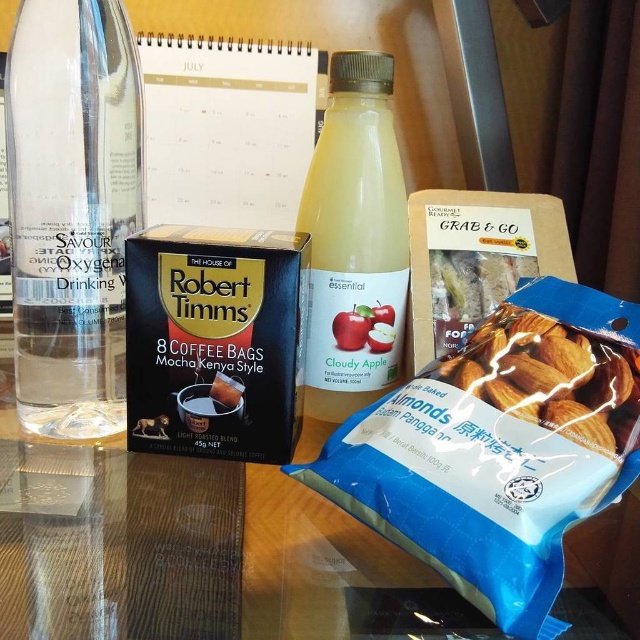
You are standing in front of the table with the items. There are two points marked on the table surface. One is at coordinate point (394, 148) and the other is at point (598, 369). Which point is closer to you?

Point (394, 148) is closer to you because it is further to the camera than point (598, 369).

You are a delivery person who needs to place a new item between the clear glass bottle at left and the cloudy apple juice at center. The item is 7 inches long. Will there be enough space between them to fit the item?

The clear glass bottle at left and cloudy apple juice at center are 7.45 inches apart from each other. Since the item is 7 inches long, there is sufficient space to fit it between them as 7 inches is less than 7.45 inches.

You are setting up a small breakfast table and need to arrange the cloudy apple juice at center and the smooth almond at lower right. Considering their sizes, which item should you place first to ensure stability?

The cloudy apple juice at center is larger in size than the smooth almond at lower right, so you should place the cloudy apple juice at center first to ensure stability.